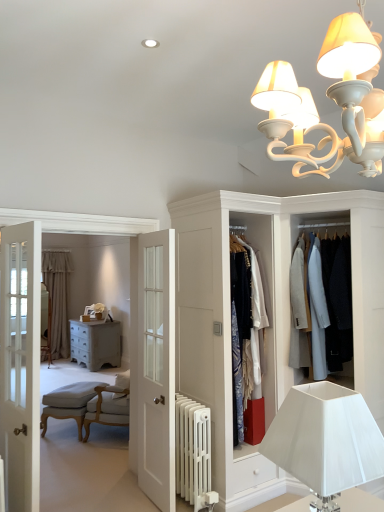
Question: Choose the correct answer: Is light gray wool coat at center, which is the first clothing from right to left, inside white matte chandelier at upper center, which appears as the 2th lamp when ordered from the bottom, or outside it?

Choices:
 (A) outside
 (B) inside

Answer: (A)

Question: Based on their positions, is light gray wool coat at center, marked as the second clothing in a left-to-right arrangement, located to the left or right of white matte chandelier at upper center, the 1th lamp viewed from the top?

Choices:
 (A) right
 (B) left

Answer: (A)

Question: Based on their relative distances, which object is nearer to the white fabric lampshade at lower right, placed as the 1th lamp when sorted from bottom to top?

Choices:
 (A) light beige fabric armchair at lower left
 (B) silky fabric dress at center, which is counted as the 2th clothing, starting from the right
 (C) white painted radiator at lower center
 (D) light gray wool coat at center, marked as the second clothing in a left-to-right arrangement
 (E) distressed gray chest of drawers at center

Answer: (C)

Question: Estimate the real-world distances between objects in this image. Which object is closer to the light beige fabric armchair at lower left?

Choices:
 (A) light gray wool coat at center, marked as the second clothing in a left-to-right arrangement
 (B) distressed gray chest of drawers at center
 (C) silky fabric dress at center, which is counted as the 2th clothing, starting from the right
 (D) white glossy door at center
 (E) white fabric lampshade at lower right, placed as the 1th lamp when sorted from bottom to top

Answer: (B)